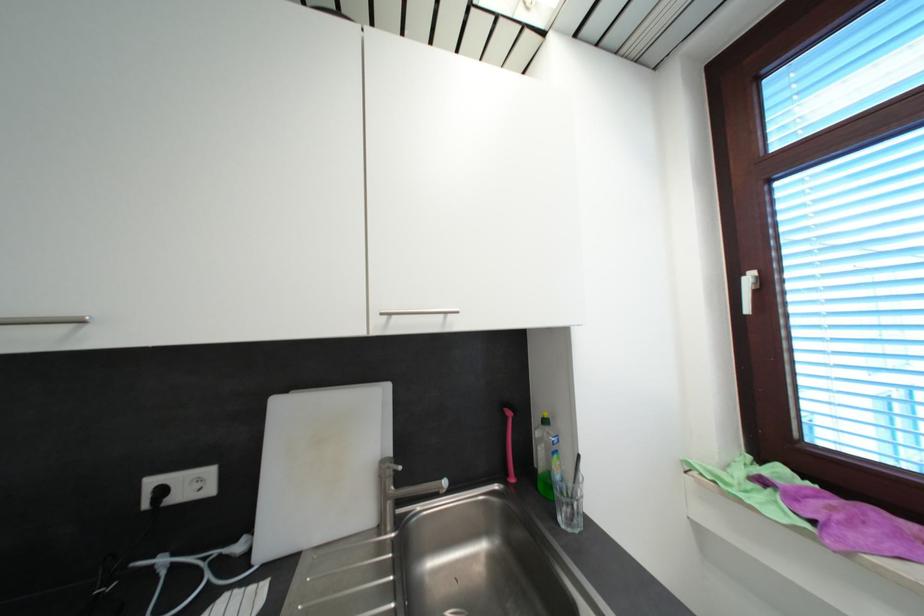
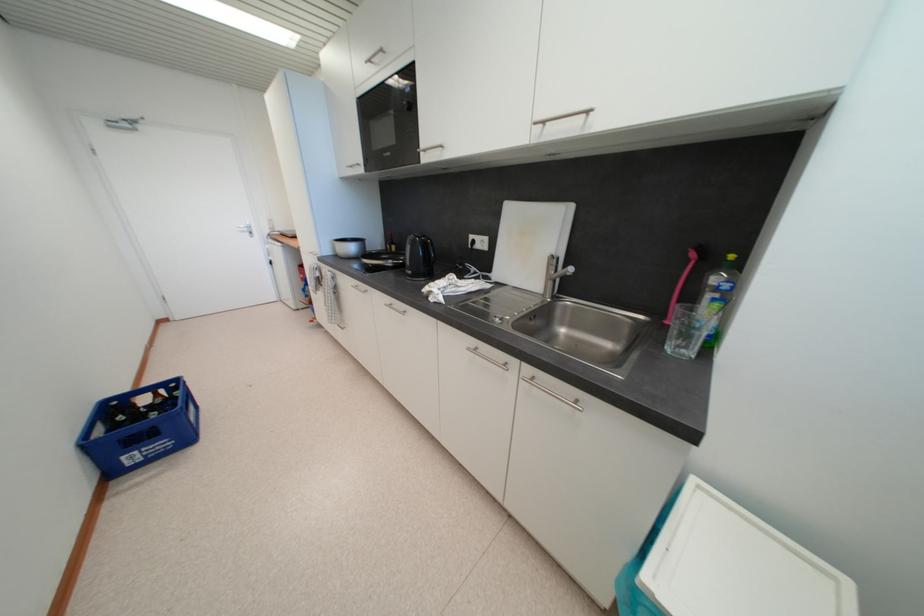
In the second image, find the point that corresponds to point (561, 459) in the first image.

(723, 307)